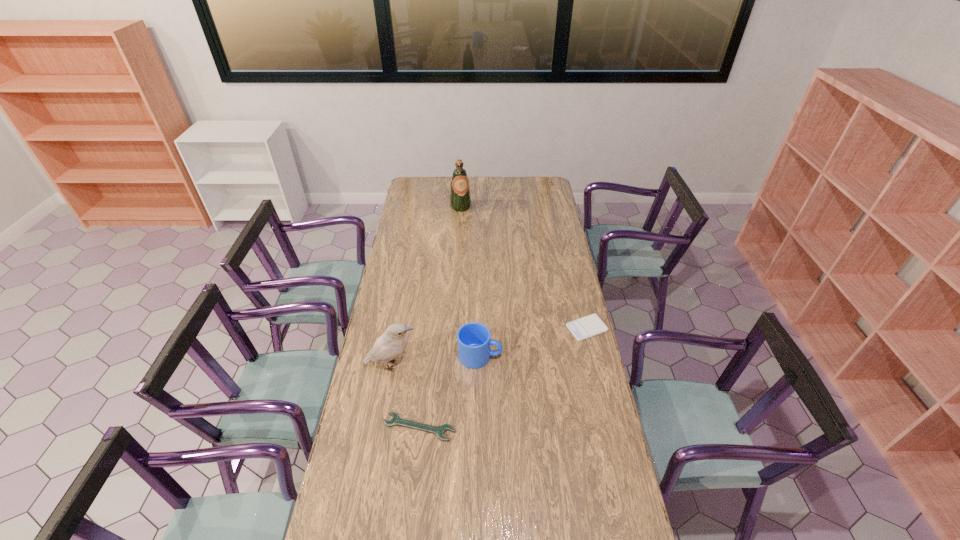
Image resolution: width=960 pixels, height=540 pixels. I want to click on unoccupied area between the third tallest object and the fourth shortest object, so click(x=436, y=361).

Where is `unoccupied position between the second tallest object and the tallest object`? unoccupied position between the second tallest object and the tallest object is located at coordinates (426, 286).

Find the location of a particular element. This screenshot has height=540, width=960. vacant space in between the nearest object and the rightmost object is located at coordinates (503, 377).

The height and width of the screenshot is (540, 960). Identify the location of free space between the farthest object and the wrench. tap(440, 317).

Identify the location of free space between the nearest object and the olive oil. This screenshot has width=960, height=540. (440, 317).

Locate which object ranks in proximity to the olive oil. Please provide its 2D coordinates. Your answer should be formatted as a tuple, i.e. [(x, y)], where the tuple contains the x and y coordinates of a point satisfying the conditions above.

[(583, 328)]

Locate which object ranks fourth in proximity to the wrench. Please provide its 2D coordinates. Your answer should be formatted as a tuple, i.e. [(x, y)], where the tuple contains the x and y coordinates of a point satisfying the conditions above.

[(460, 200)]

Identify the location of vacant point that satisfies the following two spatial constraints: 1. on the front side of the nearest object; 2. on the left side of the second tallest object. (380, 427).

The height and width of the screenshot is (540, 960). In order to click on vacant space that satisfies the following two spatial constraints: 1. on the back side of the wrench; 2. on the right side of the mug in this screenshot , I will do `click(426, 356)`.